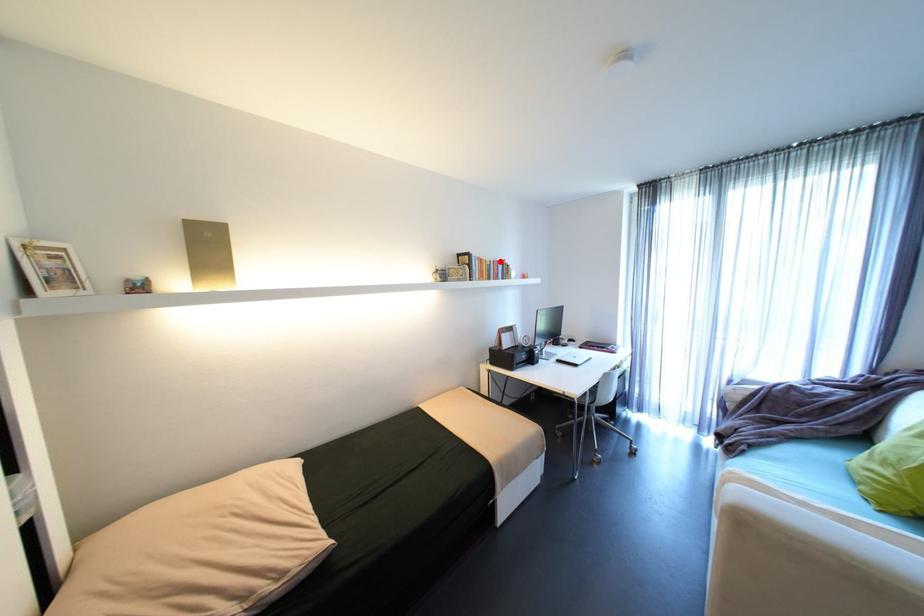
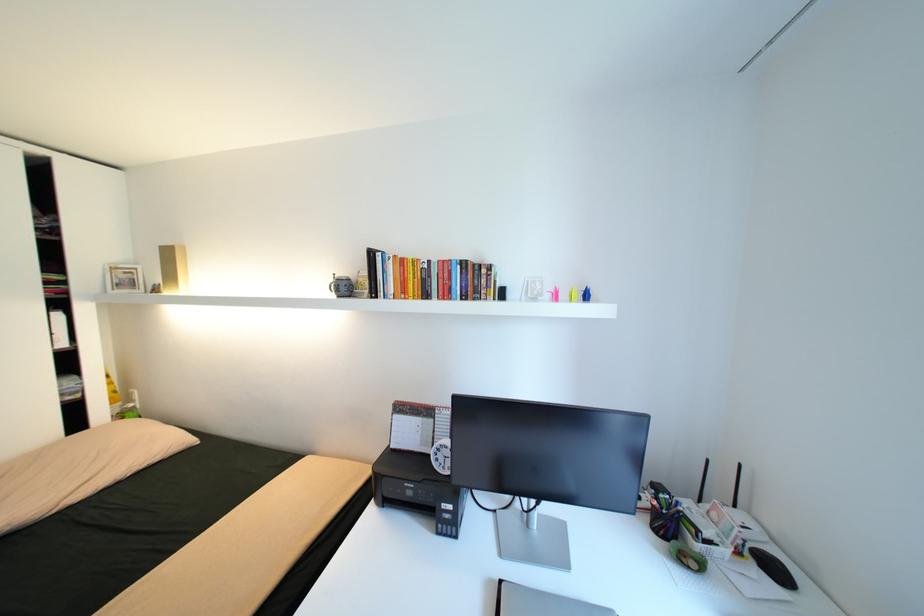
Find the pixel in the second image that matches the highlighted location in the first image.

(445, 262)